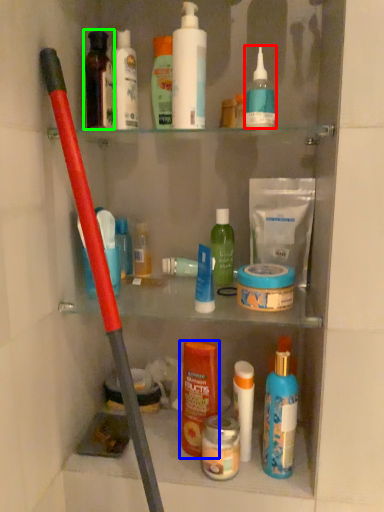
Question: Which is nearer to the toiletry (highlighted by a red box)? toiletry (highlighted by a blue box) or toiletry (highlighted by a green box).

Choices:
 (A) toiletry
 (B) toiletry

Answer: (B)